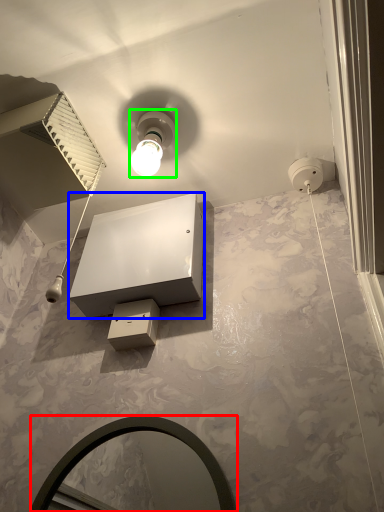
Question: Which object is the farthest from mirror (highlighted by a red box)? Choose among these: vanity (highlighted by a blue box) or light fixture (highlighted by a green box).

Choices:
 (A) vanity
 (B) light fixture

Answer: (B)